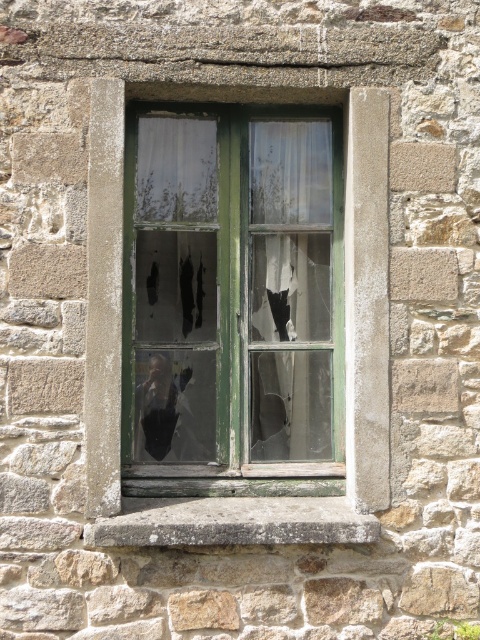
Question: Which point appears closest to the camera in this image?

Choices:
 (A) (262, 150)
 (B) (279, 529)

Answer: (B)

Question: Considering the relative positions of green wooden window at center and gray concrete at center in the image provided, where is green wooden window at center located with respect to gray concrete at center?

Choices:
 (A) above
 (B) below

Answer: (A)

Question: Which point appears closest to the camera in this image?

Choices:
 (A) (243, 214)
 (B) (265, 525)

Answer: (B)

Question: Can you confirm if green wooden window at center is positioned to the left of gray concrete at center?

Choices:
 (A) yes
 (B) no

Answer: (B)

Question: Is green wooden window at center below gray concrete at center?

Choices:
 (A) no
 (B) yes

Answer: (A)